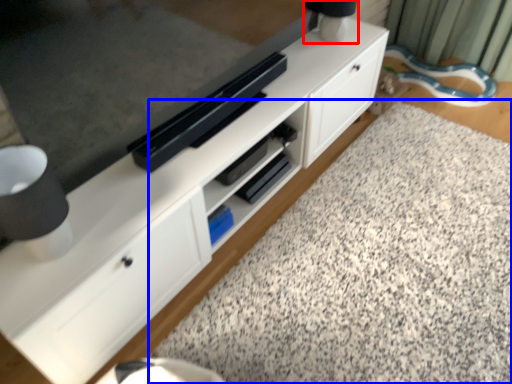
Question: Which point is further to the camera, table lamp (highlighted by a red box) or granite (highlighted by a blue box)?

Choices:
 (A) table lamp
 (B) granite

Answer: (A)